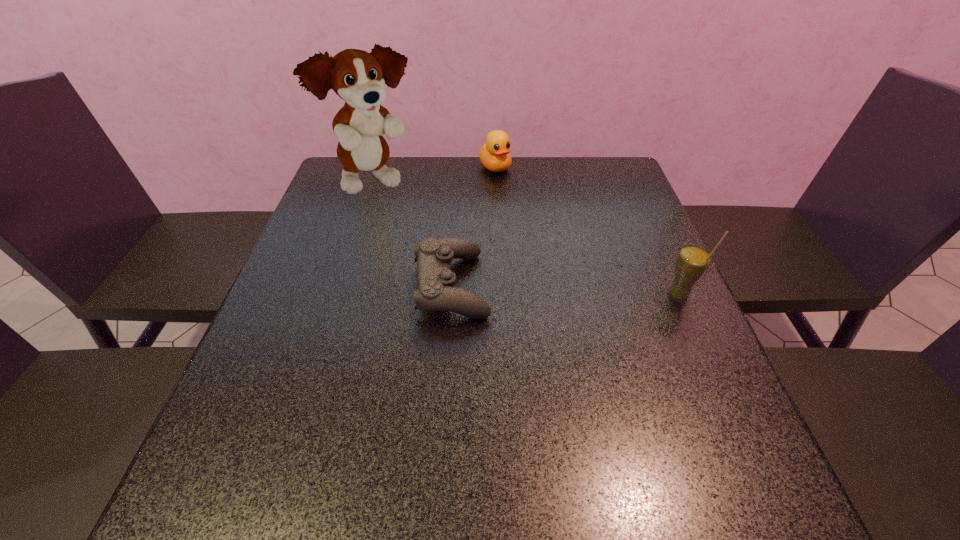
The image size is (960, 540). I want to click on vacant space that satisfies the following two spatial constraints: 1. on the front side of the third tallest object; 2. on the left side of the third shortest object, so click(501, 295).

Where is `free space that satisfies the following two spatial constraints: 1. on the front side of the tallest object; 2. on the left side of the shortest object`? This screenshot has width=960, height=540. free space that satisfies the following two spatial constraints: 1. on the front side of the tallest object; 2. on the left side of the shortest object is located at coordinates (345, 286).